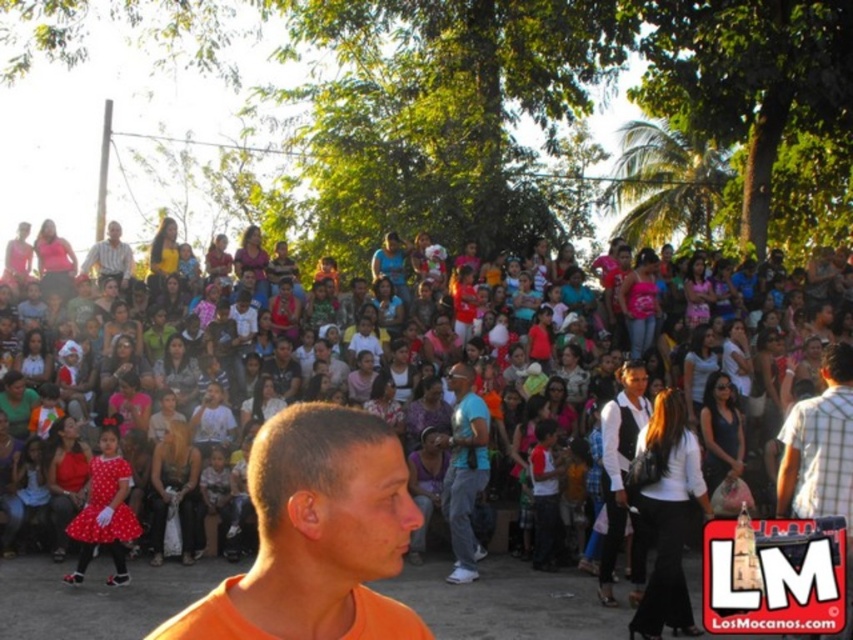
Question: Which point is closer to the camera?

Choices:
 (A) (550, 577)
 (B) (608, 429)
 (C) (821, 465)
 (D) (479, 426)

Answer: (C)

Question: Does orange matte shirt at center have a larger size compared to matte pink dress at center?

Choices:
 (A) yes
 (B) no

Answer: (A)

Question: Can you confirm if orange matte shirt at center is positioned below light brown shirt at center?

Choices:
 (A) no
 (B) yes

Answer: (B)

Question: Which of the following is the farthest from the observer?

Choices:
 (A) orange matte shirt at center
 (B) white matte vest at center
 (C) blue fabric shirt at center

Answer: (C)

Question: Can you confirm if orange matte shirt at center is smaller than white matte vest at center?

Choices:
 (A) yes
 (B) no

Answer: (B)

Question: Which object is closer to the camera taking this photo?

Choices:
 (A) white matte vest at center
 (B) orange matte shirt at center

Answer: (B)